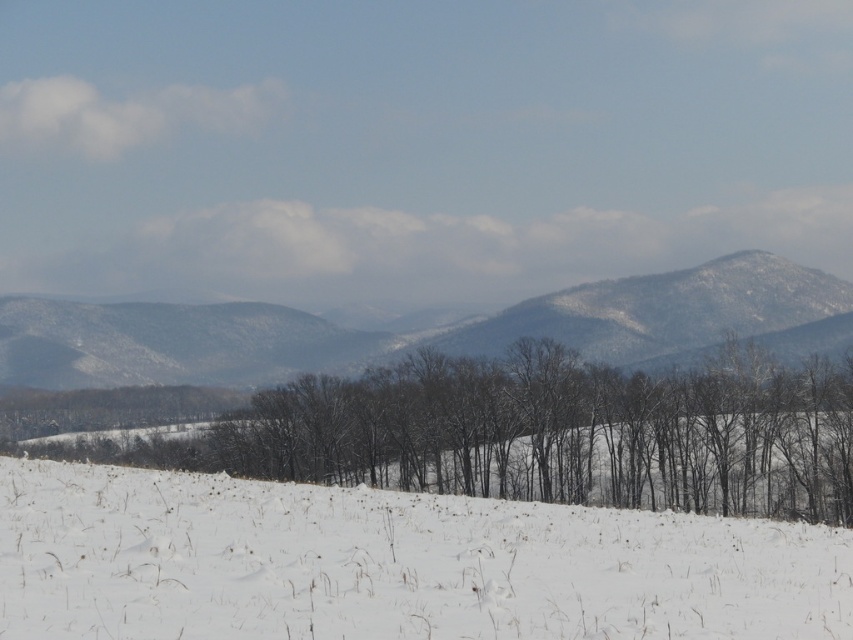
Question: Is white snow at center below snowy bare trees at lower center?

Choices:
 (A) no
 (B) yes

Answer: (A)

Question: Does white snow at center appear over snowy textured mountain at center?

Choices:
 (A) no
 (B) yes

Answer: (A)

Question: Is white snow at center smaller than snowy textured mountain at center?

Choices:
 (A) yes
 (B) no

Answer: (A)

Question: Among these objects, which one is nearest to the camera?

Choices:
 (A) white snow at center
 (B) snowy bare trees at lower center

Answer: (A)

Question: Which object is closer to the camera taking this photo?

Choices:
 (A) white snow at center
 (B) snowy bare trees at lower center

Answer: (A)

Question: Based on their relative distances, which object is farther from the white snow at center?

Choices:
 (A) snowy textured mountain at center
 (B) snowy bare trees at lower center

Answer: (A)